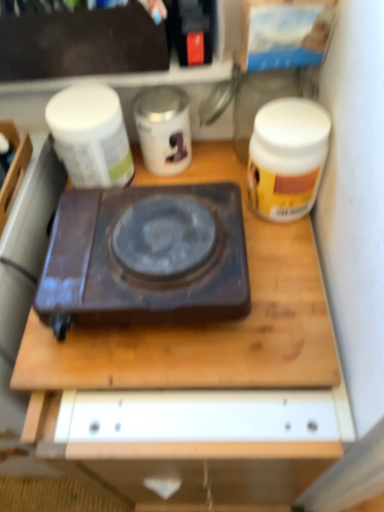
Question: Is dark brown plastic gas stove at center positioned behind white glossy canister at center, the 1th yoghurt positioned from the right?

Choices:
 (A) no
 (B) yes

Answer: (A)

Question: Does dark brown plastic gas stove at center appear on the right side of white glossy canister at center, the 1th yoghurt positioned from the right?

Choices:
 (A) no
 (B) yes

Answer: (A)

Question: Considering the relative sizes of dark brown plastic gas stove at center and white glossy canister at center, the second yoghurt positioned from the left, in the image provided, is dark brown plastic gas stove at center wider than white glossy canister at center, the second yoghurt positioned from the left,?

Choices:
 (A) no
 (B) yes

Answer: (B)

Question: Is white glossy canister at center, the 1th yoghurt positioned from the right, inside dark brown plastic gas stove at center?

Choices:
 (A) yes
 (B) no

Answer: (B)

Question: From a real-world perspective, is dark brown plastic gas stove at center below white glossy canister at center, the 1th yoghurt positioned from the right?

Choices:
 (A) yes
 (B) no

Answer: (A)

Question: Does dark brown plastic gas stove at center have a lesser height compared to white glossy canister at center, the second yoghurt positioned from the left?

Choices:
 (A) no
 (B) yes

Answer: (B)

Question: From the image's perspective, is white matte jar at upper left, the 2th yoghurt from the right, beneath transparent glass jar at upper center?

Choices:
 (A) no
 (B) yes

Answer: (B)

Question: Considering the relative sizes of white matte jar at upper left, the first yoghurt when ordered from left to right, and transparent glass jar at upper center in the image provided, is white matte jar at upper left, the first yoghurt when ordered from left to right, smaller than transparent glass jar at upper center?

Choices:
 (A) yes
 (B) no

Answer: (A)

Question: Is white matte jar at upper left, the first yoghurt when ordered from left to right, not close to transparent glass jar at upper center?

Choices:
 (A) no
 (B) yes

Answer: (A)

Question: Is white matte jar at upper left, the first yoghurt when ordered from left to right, not within transparent glass jar at upper center?

Choices:
 (A) no
 (B) yes

Answer: (B)

Question: Is transparent glass jar at upper center surrounded by white matte jar at upper left, the 2th yoghurt from the right?

Choices:
 (A) yes
 (B) no

Answer: (B)

Question: Is white matte jar at upper left, the 2th yoghurt from the right, turned away from transparent glass jar at upper center?

Choices:
 (A) no
 (B) yes

Answer: (A)

Question: Is matte black box at upper left outside transparent glass jar at upper center?

Choices:
 (A) no
 (B) yes

Answer: (B)